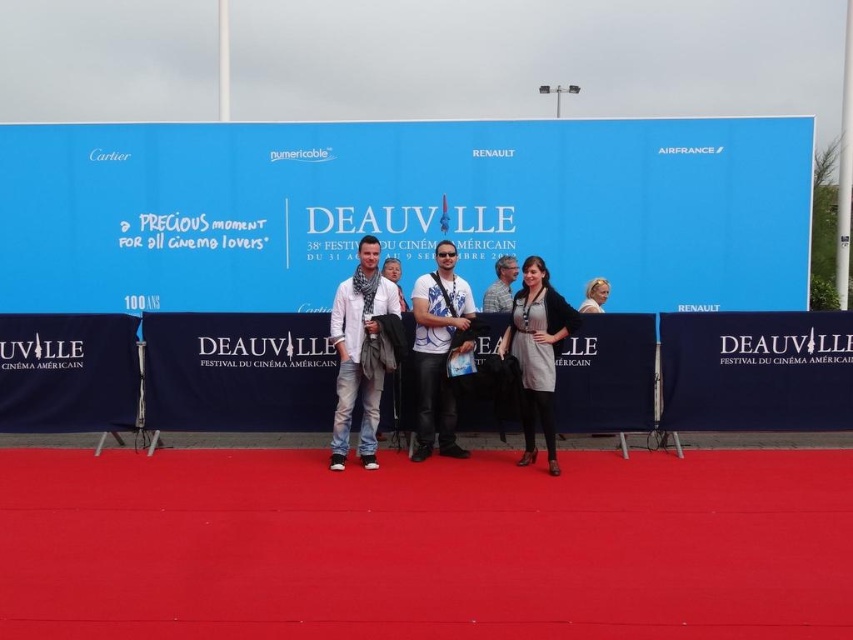
Question: Does matte white shirt at center come behind gray striped shirt at center?

Choices:
 (A) no
 (B) yes

Answer: (A)

Question: Which is nearer to the white fabric headscarf at upper right?

Choices:
 (A) gray fabric dress at center
 (B) gray striped shirt at center

Answer: (B)

Question: Which point is farther from the camera taking this photo?

Choices:
 (A) (398, 280)
 (B) (593, 289)

Answer: (B)

Question: In this image, where is matte gray scarf at center located relative to gray striped shirt at center?

Choices:
 (A) right
 (B) left

Answer: (B)

Question: Does matte white shirt at center appear under gray striped shirt at center?

Choices:
 (A) yes
 (B) no

Answer: (A)

Question: Which object is closer to the camera taking this photo?

Choices:
 (A) matte white shirt at center
 (B) gray striped shirt at center
 (C) matte gray scarf at center
 (D) white fabric headscarf at upper right

Answer: (C)